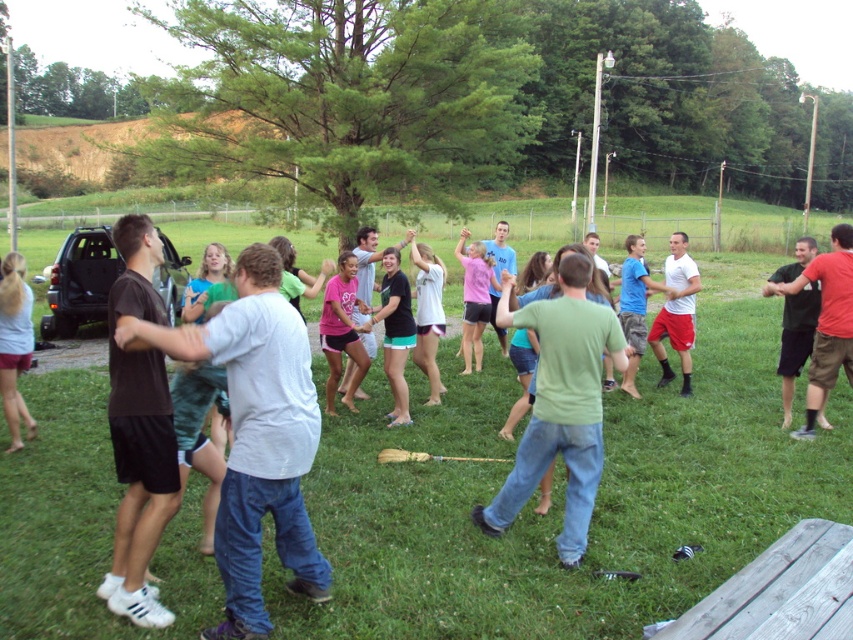
Can you confirm if black cotton shirt at center is smaller than white cotton shirt at center?

No.

At what (x,y) coordinates should I click in order to perform the action: click on black cotton shirt at center. Please return your answer as a coordinate pair (x, y). Image resolution: width=853 pixels, height=640 pixels. Looking at the image, I should click on (827, 321).

Which is more to the left, light gray cotton shirt at lower left or white cotton shirt at center?

Positioned to the left is light gray cotton shirt at lower left.

Who is lower down, light gray cotton shirt at lower left or white cotton shirt at center?

light gray cotton shirt at lower left is lower down.

Who is more forward, [16,416] or [434,374]?

Positioned in front is point [16,416].

Locate an element on the screen. This screenshot has width=853, height=640. light gray cotton shirt at lower left is located at coordinates (15, 344).

Does green grass at center have a lesser width compared to green matte shirt at center?

No.

Does point (343, 508) lie behind point (548, 332)?

Yes, point (343, 508) is farther from viewer.

Locate an element on the screen. This screenshot has height=640, width=853. green grass at center is located at coordinates (563, 496).